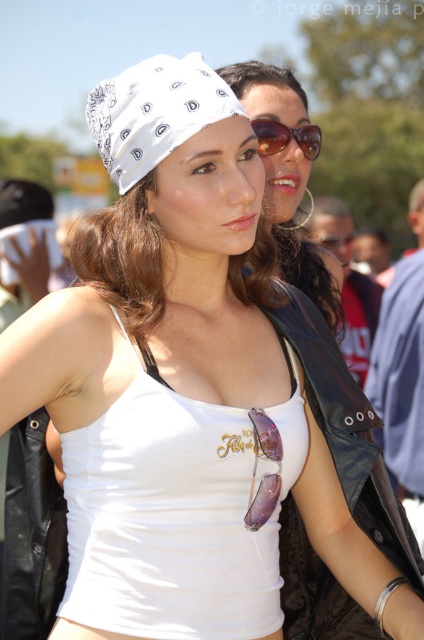
Question: In this image, where is shiny black leather jacket at center located relative to sunglasses at center?

Choices:
 (A) below
 (B) above

Answer: (A)

Question: Which of the following is the closest to the observer?

Choices:
 (A) (248, 102)
 (B) (300, 136)
 (C) (134, 122)
 (D) (334, 438)

Answer: (C)

Question: Does white printed bandana at upper center come in front of sunglasses at center?

Choices:
 (A) yes
 (B) no

Answer: (A)

Question: Which point is closer to the camera?

Choices:
 (A) sunglasses at center
 (B) matte black sunglasses at upper center

Answer: (B)

Question: Which of the following is the closest to the observer?

Choices:
 (A) (318, 636)
 (B) (278, 140)
 (C) (145, 116)
 (D) (287, 86)

Answer: (C)

Question: Is matte black sunglasses at upper center wider than sunglasses at center?

Choices:
 (A) no
 (B) yes

Answer: (B)